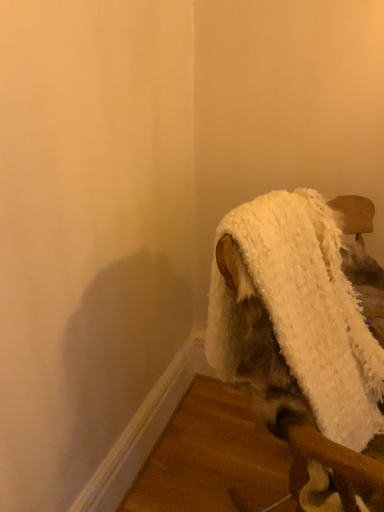
I want to click on white fluffy blanket at upper right, so click(x=258, y=347).

What do you see at coordinates (258, 347) in the screenshot? The height and width of the screenshot is (512, 384). I see `white fluffy blanket at upper right` at bounding box center [258, 347].

At what (x,y) coordinates should I click in order to perform the action: click on white fluffy blanket at upper right. Please return your answer as a coordinate pair (x, y). This screenshot has width=384, height=512. Looking at the image, I should click on (258, 347).